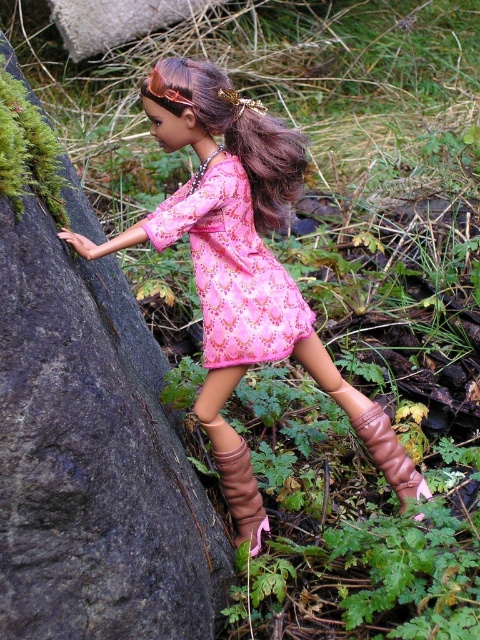
Is smooth gray rock at left wider than brown shiny hair at center?

Correct, the width of smooth gray rock at left exceeds that of brown shiny hair at center.

Is smooth gray rock at left below brown shiny hair at center?

Yes, smooth gray rock at left is below brown shiny hair at center.

Locate an element on the screen. The height and width of the screenshot is (640, 480). smooth gray rock at left is located at coordinates (93, 460).

Is point (279, 353) behind point (255, 545)?

No, (279, 353) is in front of (255, 545).

Who is lower down, pink fabric dress at center or brown leather boot at center?

brown leather boot at center

Does point (203, 336) come behind point (250, 532)?

Yes, it is behind point (250, 532).

Where is `pink fabric dress at center`? pink fabric dress at center is located at coordinates (231, 269).

Is point (228, 184) farther from viewer compared to point (230, 502)?

No, it is in front of (230, 502).

Does pink satin dress at center have a smaller size compared to brown leather boot at center?

No, pink satin dress at center is not smaller than brown leather boot at center.

Where is `pink satin dress at center`? This screenshot has height=640, width=480. pink satin dress at center is located at coordinates (241, 252).